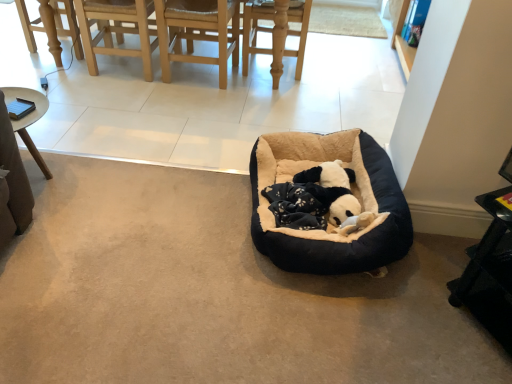
Identify the location of black plastic table at lower right. The image size is (512, 384). (489, 273).

The image size is (512, 384). I want to click on light wood chair at upper left, so click(116, 30).

You are a GUI agent. You are given a task and a screenshot of the screen. Output one action in this format:
    pyautogui.click(x=<x>, y=<y>)
    Task: Click on the black plush dog bed at center
    
    Given the screenshot: What is the action you would take?
    pyautogui.click(x=353, y=193)

Which object is positioned more to the left, light wood chair at upper left or black plush dog bed at center?

Positioned to the left is light wood chair at upper left.

Does point (109, 4) lie behind point (399, 219)?

Yes, it is behind point (399, 219).

From the image's perspective, would you say light wood chair at upper left is shown under black plush dog bed at center?

Actually, light wood chair at upper left appears above black plush dog bed at center in the image.

Is light wood chair at upper left completely or partially outside of black plush dog bed at center?

Yes, light wood chair at upper left is outside of black plush dog bed at center.

Considering the relative sizes of black plush dog bed at center and black plastic table at lower right in the image provided, is black plush dog bed at center taller than black plastic table at lower right?

No.

Based on the photo, can you see black plush dog bed at center touching black plastic table at lower right?

black plush dog bed at center and black plastic table at lower right are not in contact.

From the image's perspective, between black plush dog bed at center and black plastic table at lower right, which one is located above?

black plush dog bed at center, from the image's perspective.

From a real-world perspective, is black plush dog bed at center positioned under black plastic table at lower right based on gravity?

Yes, from a real-world perspective, black plush dog bed at center is beneath black plastic table at lower right.

Is black plastic table at lower right shorter than black plush dog bed at center?

In fact, black plastic table at lower right may be taller than black plush dog bed at center.

Can you confirm if black plastic table at lower right is smaller than black plush dog bed at center?

Correct, black plastic table at lower right occupies less space than black plush dog bed at center.

Between point (482, 306) and point (361, 263), which one is positioned behind?

Positioned behind is point (361, 263).

In the scene shown: From the image's perspective, is black plastic table at lower right positioned above or below black plush dog bed at center?

From the image's perspective, black plastic table at lower right appears below black plush dog bed at center.

Which is correct: light wood chair at upper left is inside black plastic table at lower right, or outside of it?

light wood chair at upper left is not enclosed by black plastic table at lower right.

In terms of width, does light wood chair at upper left look wider or thinner when compared to black plastic table at lower right?

Considering their sizes, light wood chair at upper left looks slimmer than black plastic table at lower right.

From the image's perspective, would you say light wood chair at upper left is positioned over black plastic table at lower right?

Yes, from the image's perspective, light wood chair at upper left is above black plastic table at lower right.

Is black plush dog bed at center far away from light wood chair at upper left?

Indeed, black plush dog bed at center is not near light wood chair at upper left.

From the image's perspective, does black plush dog bed at center appear higher than light wood chair at upper left?

No, from the image's perspective, black plush dog bed at center is not over light wood chair at upper left.

Is black plush dog bed at center taller or shorter than light wood chair at upper left?

Considering their sizes, black plush dog bed at center has less height than light wood chair at upper left.

From the picture: Between black plastic table at lower right and light wood chair at upper left, which one is positioned in front?

black plastic table at lower right is more forward.

Is black plastic table at lower right spatially inside light wood chair at upper left, or outside of it?

black plastic table at lower right is not enclosed by light wood chair at upper left.

Between black plastic table at lower right and light wood chair at upper left, which one appears on the right side from the viewer's perspective?

black plastic table at lower right.

The image size is (512, 384). I want to click on dog bed below the light wood chair at upper left (from the image's perspective), so click(x=353, y=193).

You are a GUI agent. You are given a task and a screenshot of the screen. Output one action in this format:
    pyautogui.click(x=<x>, y=<y>)
    Task: Click on the table on the right of black plush dog bed at center
    
    Given the screenshot: What is the action you would take?
    pyautogui.click(x=489, y=273)

Estimate the real-world distances between objects in this image. Which object is further from light wood chair at upper left, black plastic table at lower right or black plush dog bed at center?

black plastic table at lower right lies further to light wood chair at upper left than the other object.

From the image, which object appears to be farther from black plush dog bed at center, black plastic table at lower right or light wood chair at upper left?

Based on the image, light wood chair at upper left appears to be further to black plush dog bed at center.

When comparing their distances from light wood chair at upper left, does black plush dog bed at center or black plastic table at lower right seem closer?

black plush dog bed at center is positioned closer to the anchor light wood chair at upper left.

Based on their spatial positions, is light wood chair at upper left or black plastic table at lower right further from black plush dog bed at center?

light wood chair at upper left lies further to black plush dog bed at center than the other object.

Based on their spatial positions, is light wood chair at upper left or black plush dog bed at center further from black plastic table at lower right?

light wood chair at upper left is further to black plastic table at lower right.

Considering their positions, is black plush dog bed at center positioned further to black plastic table at lower right than light wood chair at upper left?

light wood chair at upper left is positioned further to the anchor black plastic table at lower right.

I want to click on dog bed between light wood chair at upper left and black plastic table at lower right in the horizontal direction, so pos(353,193).